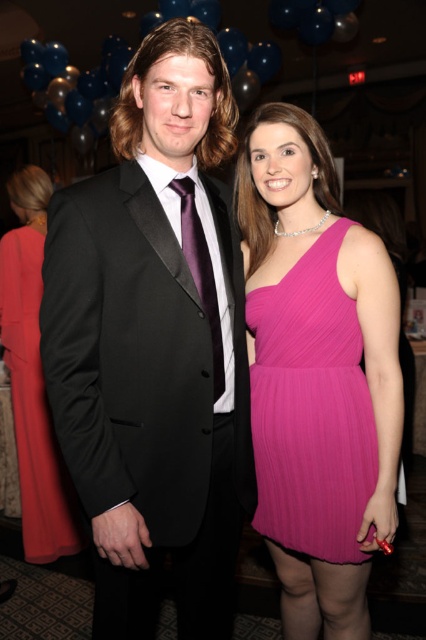
Between black satin suit at center and silky red dress at center, which one has more height?

silky red dress at center

Can you confirm if black satin suit at center is positioned to the left of silky red dress at center?

No, black satin suit at center is not to the left of silky red dress at center.

Which is in front, point (74, 308) or point (28, 500)?

Point (74, 308) is more forward.

Find the location of a particular element. This screenshot has width=426, height=640. black satin suit at center is located at coordinates (155, 346).

Is point (206, 72) closer to camera compared to point (276, 385)?

Yes, point (206, 72) is closer to viewer.

Between black satin suit at center and pink pleated dress at center, which one has less height?

pink pleated dress at center is shorter.

Who is more distant from viewer, (100, 237) or (354, 344)?

The point (354, 344) is behind.

This screenshot has width=426, height=640. What are the coordinates of `black satin suit at center` in the screenshot? It's located at (155, 346).

Is the position of pink pleated dress at center less distant than that of purple satin tie at center?

No.

Is pink pleated dress at center smaller than purple satin tie at center?

Actually, pink pleated dress at center might be larger than purple satin tie at center.

Identify the location of pink pleated dress at center. (310, 408).